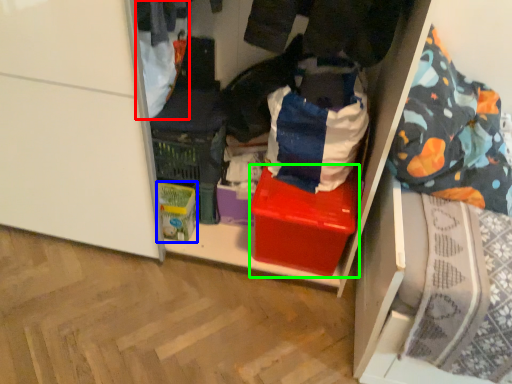
Question: Which object is positioned closest to clothing (highlighted by a red box)? Select from storage box (highlighted by a blue box) and box (highlighted by a green box).

Choices:
 (A) storage box
 (B) box

Answer: (A)